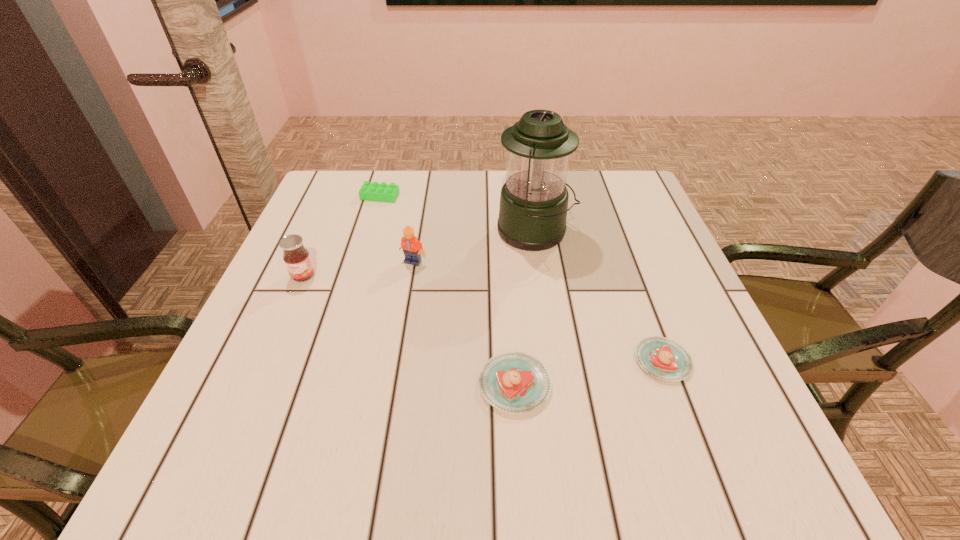
Identify the location of vacant space in between the shorter Lego and the lantern. The width and height of the screenshot is (960, 540). (457, 214).

I want to click on object that is the third closest to the shorter Lego, so click(x=533, y=208).

Locate an element on the screen. The height and width of the screenshot is (540, 960). object that stands as the closest to the farthest object is located at coordinates (412, 248).

Find the location of a particular element. This screenshot has width=960, height=540. vacant position in the image that satisfies the following two spatial constraints: 1. on the back side of the shorter pastry; 2. on the right side of the taller pastry is located at coordinates (514, 361).

Identify the location of vacant area in the image that satisfies the following two spatial constraints: 1. on the front-facing side of the taller pastry; 2. on the left side of the right Lego. (x=393, y=384).

At what (x,y) coordinates should I click in order to perform the action: click on free location that satisfies the following two spatial constraints: 1. on the front side of the shorter Lego; 2. on the right side of the lantern. Please return your answer as a coordinate pair (x, y). The width and height of the screenshot is (960, 540). Looking at the image, I should click on (370, 232).